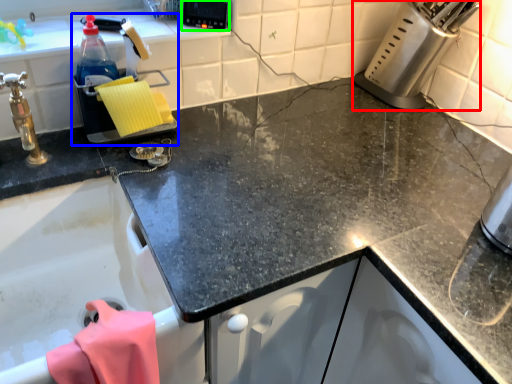
Question: Considering the real-world distances, which object is closest to appliance (highlighted by a red box)? appliance (highlighted by a blue box) or appliance (highlighted by a green box).

Choices:
 (A) appliance
 (B) appliance

Answer: (B)